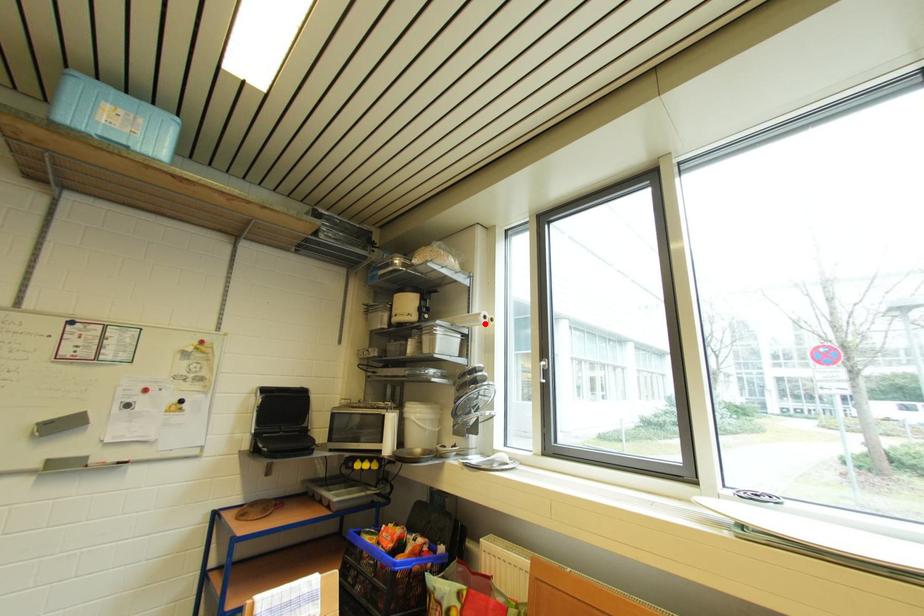
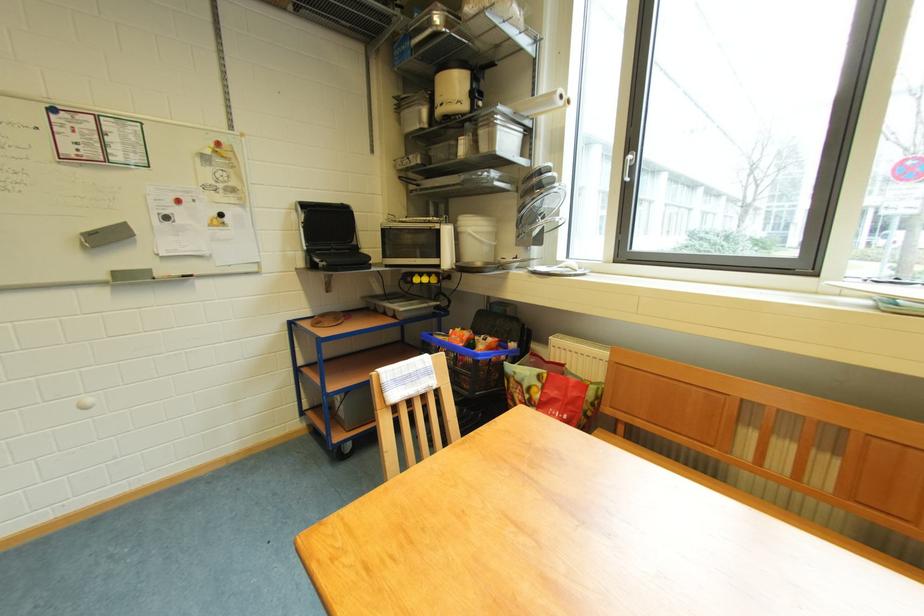
The point at the highlighted location is marked in the first image. Where is the corresponding point in the second image?

(560, 103)